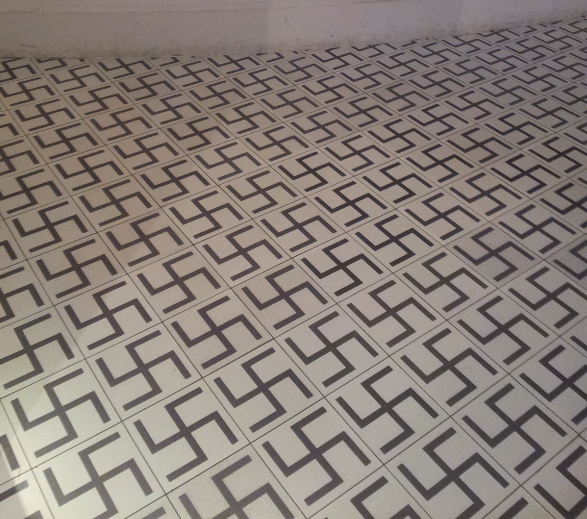
The width and height of the screenshot is (587, 519). In order to click on tile in this screenshot , I will do `click(549, 318)`.